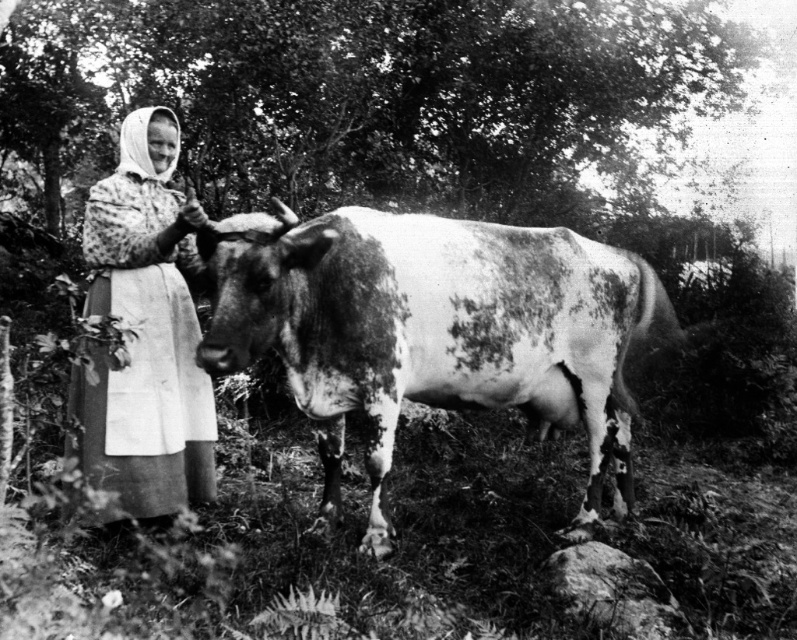
Between speckled fur at center and floral-patterned fabric at left, which one is positioned lower?

Positioned lower is speckled fur at center.

Does point (324, 362) come behind point (142, 362)?

Yes, point (324, 362) is behind point (142, 362).

Is point (591, 305) farther from camera compared to point (167, 337)?

Yes.

This screenshot has width=797, height=640. In order to click on speckled fur at center in this screenshot , I will do `click(434, 330)`.